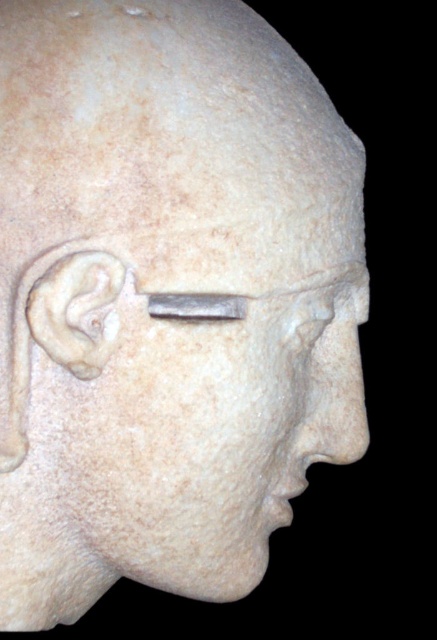
Looking at the sculpture, where is the matte stone forehead at upper center located in relation to the white marble ear at left?

The matte stone forehead at upper center is located to the right of the white marble ear at left.

You are an art conservator examining the sculpture. You need to place a protective barrier between the matte stone forehead at upper center and the white marble ear at left. What is the minimum distance the barrier should span?

The barrier should span at least 13.72 centimeters to cover the distance between the matte stone forehead at upper center and the white marble ear at left.